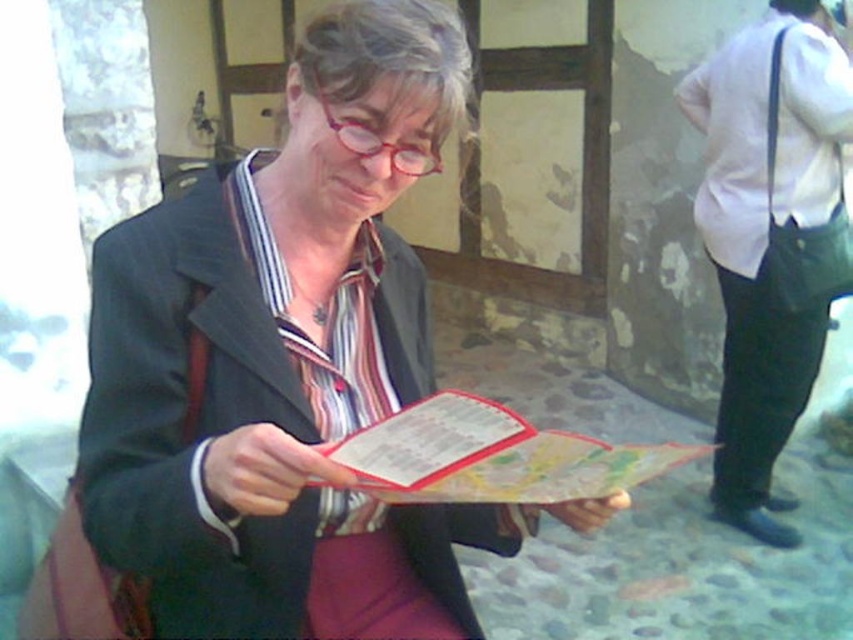
You are a delivery robot with a package that must be placed between the matte black jacket at center and the map paper at center. The minimum distance required for the package to fit is 9 inches. Can the package be placed there?

The matte black jacket at center is 8.69 inches away from the map paper at center. Since the required distance is 9 inches, the package cannot be placed there as the available space is insufficient.

You are a photographer trying to capture a clear shot of the map paper at center without the white cotton shirt at right blocking it. Based on their positions, is this possible?

The white cotton shirt at right is located above the map paper at center, so it may block the view of the map paper at center. Adjust your angle or position to avoid the obstruction caused by the white cotton shirt at right.

Where is the matte black jacket at center located in the image?

The matte black jacket at center is located at point [283,358].